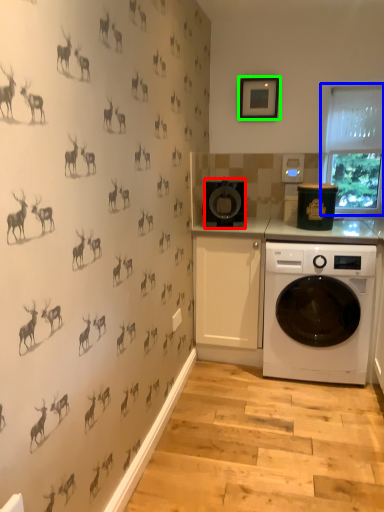
Question: Which object is the closest to the appliance (highlighted by a red box)? Choose among these: window screen (highlighted by a blue box) or picture frame (highlighted by a green box).

Choices:
 (A) window screen
 (B) picture frame

Answer: (B)